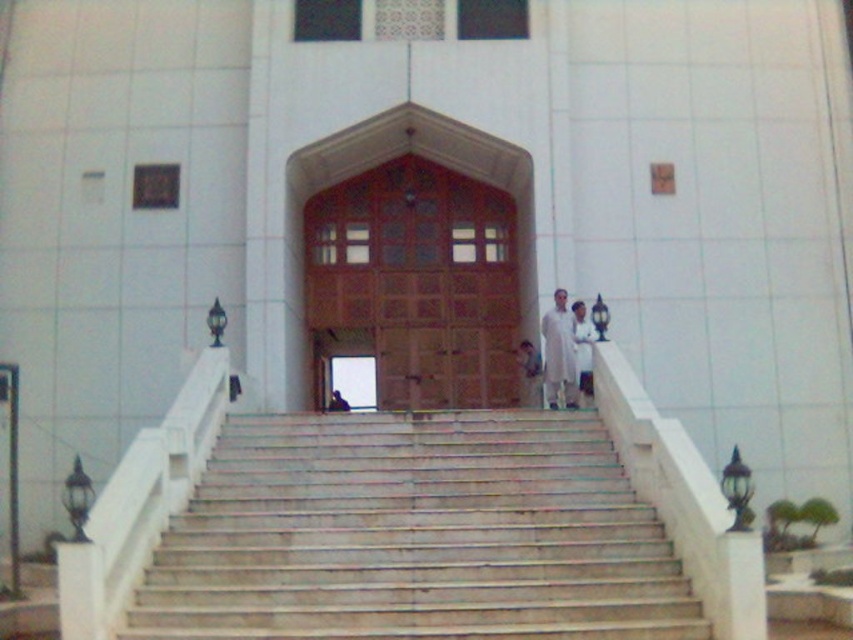
Question: Can you confirm if white cloth at center is positioned above dark blue fabric at center?

Choices:
 (A) yes
 (B) no

Answer: (A)

Question: Does white cloth at center have a larger size compared to white fabric person at center?

Choices:
 (A) yes
 (B) no

Answer: (A)

Question: Which object is closer to the camera taking this photo?

Choices:
 (A) white cotton robe at center
 (B) white fabric person at center

Answer: (A)

Question: Which point is closer to the camera?

Choices:
 (A) white marble stairs at center
 (B) white fabric person at center
 (C) dark blue fabric at center

Answer: (A)

Question: Which point is closer to the camera taking this photo?

Choices:
 (A) (549, 371)
 (B) (331, 445)
 (C) (532, 349)

Answer: (B)

Question: Does white cotton robe at center appear over white cloth at center?

Choices:
 (A) no
 (B) yes

Answer: (B)